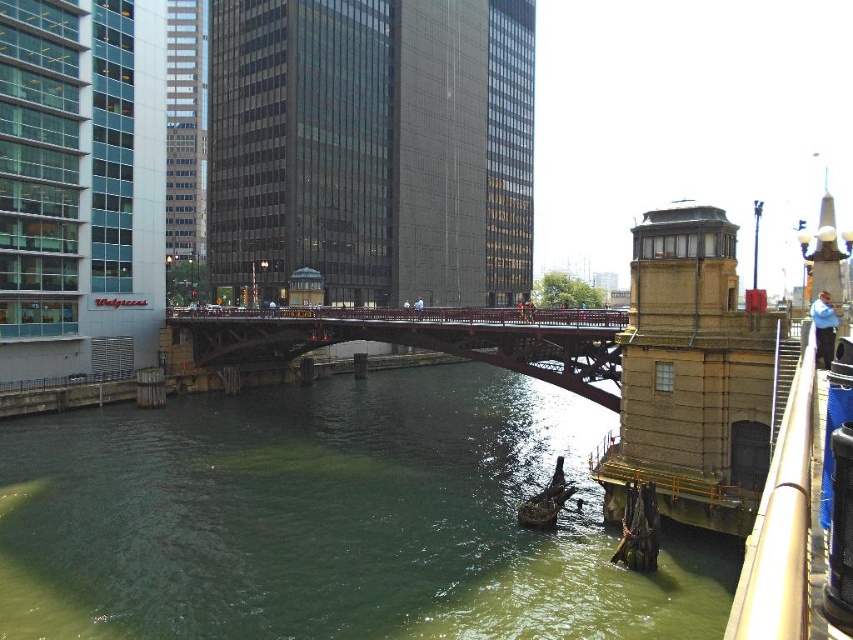
Question: Which object is positioned farthest from the green murky water at center?

Choices:
 (A) rusty metal boat at lower center
 (B) red painted steel bridge at center

Answer: (A)

Question: Which object appears closest to the camera in this image?

Choices:
 (A) rusty metal boat at lower center
 (B) green murky water at center

Answer: (B)

Question: Does green murky water at center have a larger size compared to red painted steel bridge at center?

Choices:
 (A) no
 (B) yes

Answer: (B)

Question: Is red painted steel bridge at center behind rusty metal boat at lower center?

Choices:
 (A) no
 (B) yes

Answer: (B)

Question: Does green murky water at center appear on the left side of rusty metal boat at lower center?

Choices:
 (A) no
 (B) yes

Answer: (B)

Question: Which object appears farthest from the camera in this image?

Choices:
 (A) green murky water at center
 (B) red painted steel bridge at center

Answer: (B)